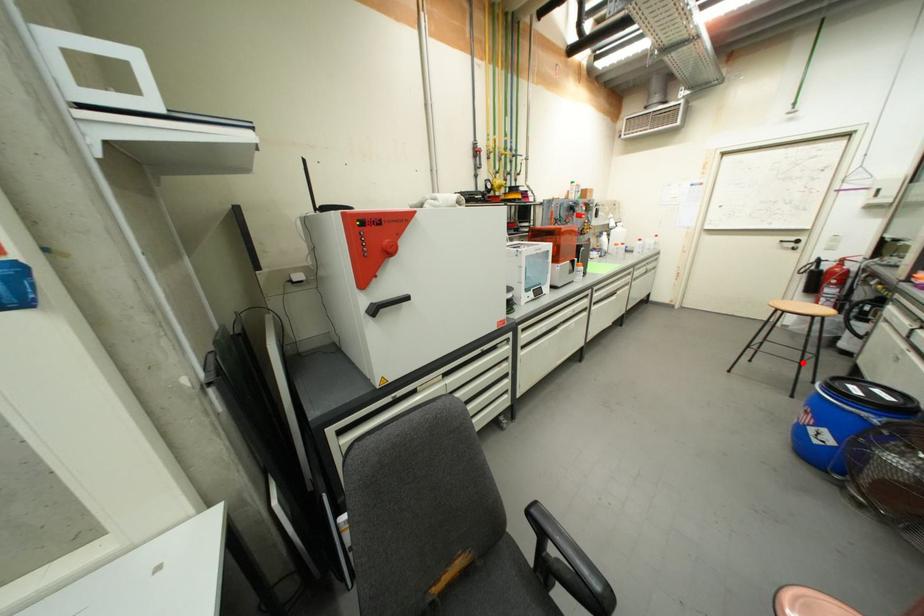
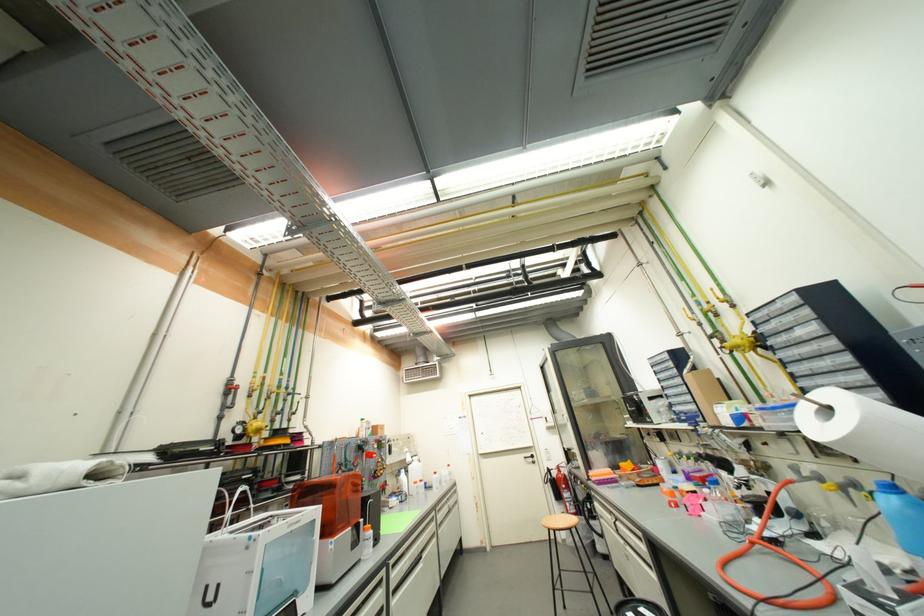
Locate, in the second image, the point that corresponds to the highlighted location in the first image.

(594, 592)